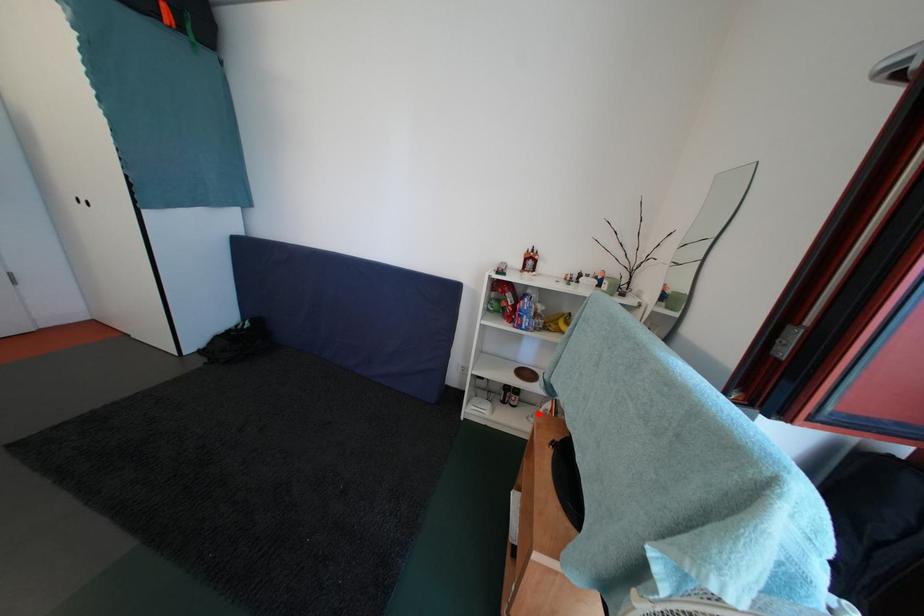
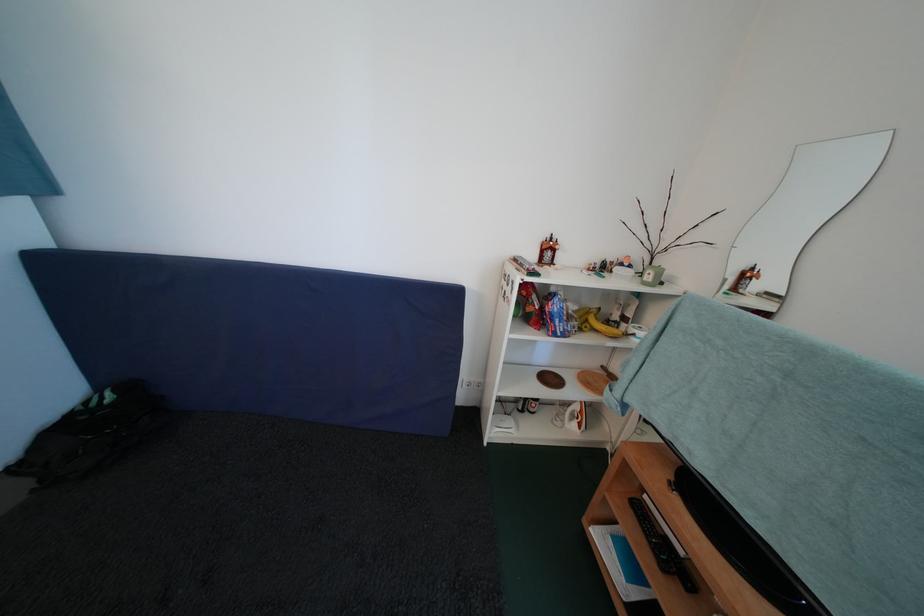
Find the pixel in the second image that matches the highlighted location in the first image.

(561, 416)